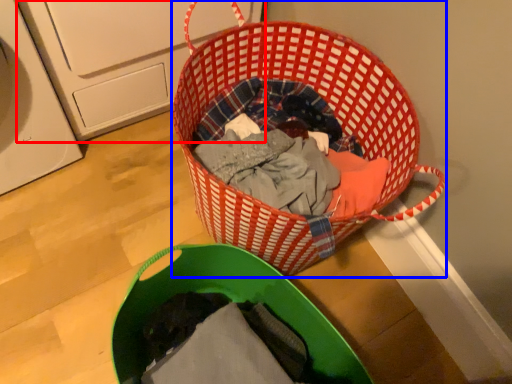
Question: Among these objects, which one is farthest to the camera, washing machine (highlighted by a red box) or picnic basket (highlighted by a blue box)?

Choices:
 (A) washing machine
 (B) picnic basket

Answer: (A)